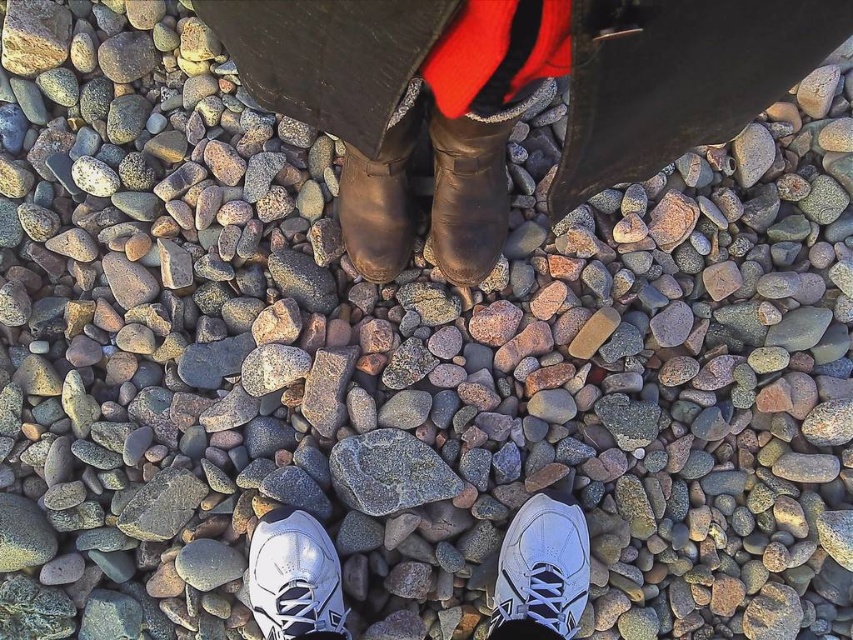
Question: Does leather boots at center appear on the left side of white mesh shoe at lower center?

Choices:
 (A) yes
 (B) no

Answer: (A)

Question: Does white mesh shoe at lower center have a greater width compared to white leather shoe at lower center?

Choices:
 (A) no
 (B) yes

Answer: (A)

Question: Based on their relative distances, which object is nearer to the white mesh shoe at lower center?

Choices:
 (A) leather boots at center
 (B) white leather shoe at lower center

Answer: (B)

Question: Can you confirm if white leather shoe at lower center is bigger than rusty metallic rock at center?

Choices:
 (A) no
 (B) yes

Answer: (B)

Question: Among these points, which one is nearest to the camera?

Choices:
 (A) (341, 44)
 (B) (381, 451)

Answer: (A)

Question: Which object is farther from the camera taking this photo?

Choices:
 (A) leather boots at center
 (B) white mesh shoe at lower center
 (C) white leather shoe at lower center

Answer: (C)